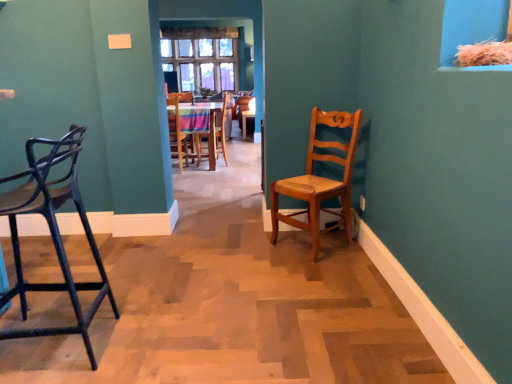
The height and width of the screenshot is (384, 512). I want to click on free space in front of light brown wooden chair at center, which is counted as the 2th chair, starting from the front, so click(x=301, y=265).